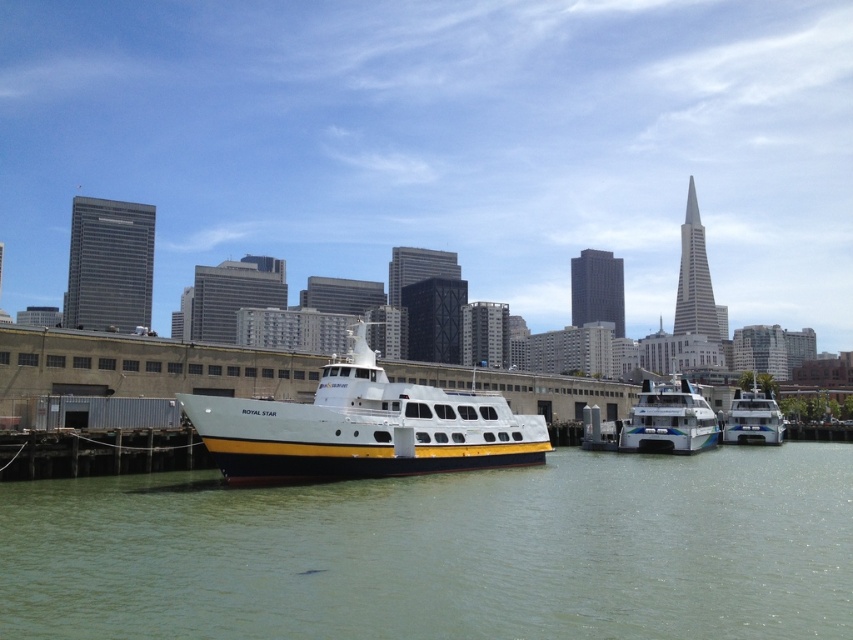
You are a photographer standing on the dock and want to take a photo of both the white glossy ferry at center and the white glossy boat at center. Which one will appear larger in your photo?

The white glossy ferry at center will appear larger in the photo because it is closer to the viewer than the white glossy boat at center.

You are a photographer positioned on the dock, aiming to capture a photo that includes both the green water at center and the white glossy ferry at center. Based on their positions, which object should you adjust your camera to focus on first to ensure both are in frame?

The green water at center is to the left of the white glossy ferry at center, so you should focus on the white glossy ferry at center first to ensure both are captured in the frame.

You are a photographer trying to capture both the white glossy ferry at center and the white glossy boat at center in a single shot. Which one should you position closer to the left side of your camera frame to include both in the photo?

You should position the white glossy ferry at center closer to the left side of your camera frame because it is already on the left side of the white glossy boat at center.